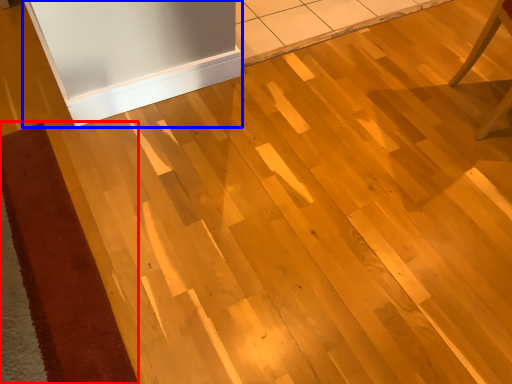
Question: Which object is further to the camera taking this photo, doormat (highlighted by a red box) or fridge (highlighted by a blue box)?

Choices:
 (A) doormat
 (B) fridge

Answer: (B)